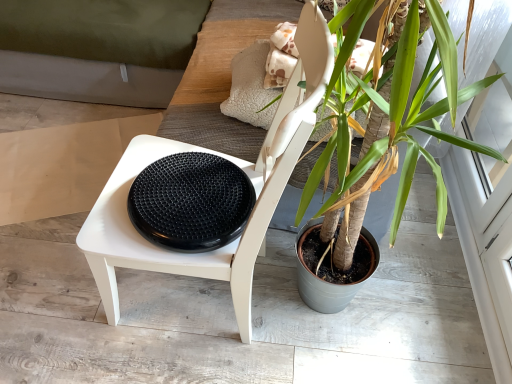
Locate an element on the screen. blank space situated above black rubber footrest at center (from a real-world perspective) is located at coordinates (172, 183).